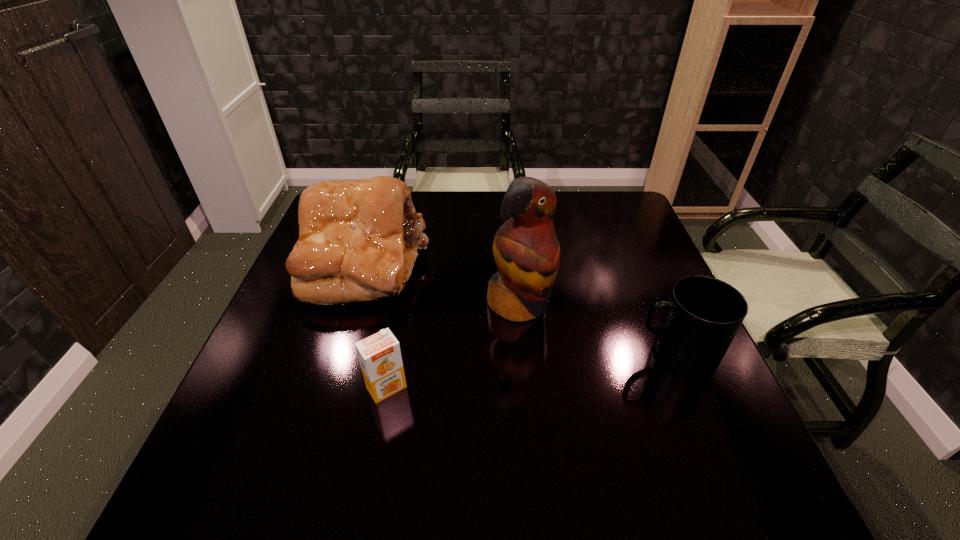
This screenshot has height=540, width=960. In order to click on free space located on the filling side of the bread in this screenshot , I will do `click(453, 321)`.

At what (x,y) coordinates should I click in order to perform the action: click on vacant space located 0.350m on the filling side of the bread. Please return your answer as a coordinate pair (x, y). Looking at the image, I should click on (523, 364).

Locate an element on the screen. This screenshot has height=540, width=960. vacant space located on the face of the parrot is located at coordinates (596, 398).

At what (x,y) coordinates should I click in order to perform the action: click on vacant space located 0.150m on the face of the parrot. Please return your answer as a coordinate pair (x, y). This screenshot has width=960, height=540. Looking at the image, I should click on (575, 373).

The width and height of the screenshot is (960, 540). I want to click on free space located 0.240m on the face of the parrot, so click(x=603, y=406).

Find the location of a particular element. object at the far edge is located at coordinates (358, 240).

Identify the location of object situated at the near edge. The width and height of the screenshot is (960, 540). (379, 355).

Find the location of a particular element. object at the left edge is located at coordinates (358, 240).

What are the coordinates of `object situated at the right edge` in the screenshot? It's located at (703, 314).

Where is `object at the far left corner`? The image size is (960, 540). object at the far left corner is located at coordinates (358, 240).